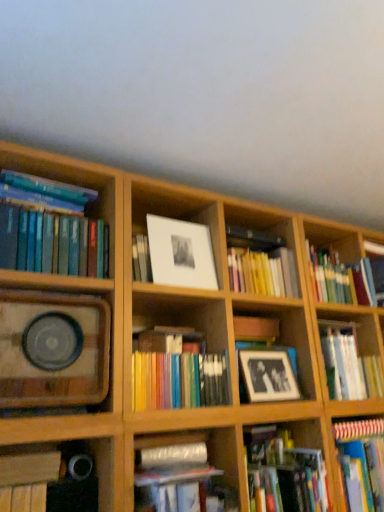
Question: Is black matte picture frame at center, the second picture frame positioned from the left, completely or partially inside wooden speaker at left, marked as the 2th shelf in a right-to-left arrangement?

Choices:
 (A) no
 (B) yes

Answer: (A)

Question: Are wooden speaker at left, marked as the 2th shelf in a right-to-left arrangement, and black matte picture frame at center, the second picture frame positioned from the left, beside each other?

Choices:
 (A) yes
 (B) no

Answer: (B)

Question: Is wooden speaker at left, marked as the 2th shelf in a right-to-left arrangement, smaller than black matte picture frame at center, the 1th picture frame in the bottom-to-top sequence?

Choices:
 (A) yes
 (B) no

Answer: (B)

Question: Considering the relative sizes of wooden speaker at left, the first shelf positioned from the left, and black matte picture frame at center, the second picture frame positioned from the left, in the image provided, is wooden speaker at left, the first shelf positioned from the left, wider than black matte picture frame at center, the second picture frame positioned from the left,?

Choices:
 (A) yes
 (B) no

Answer: (A)

Question: Can you confirm if wooden speaker at left, marked as the 2th shelf in a right-to-left arrangement, is thinner than black matte picture frame at center, the second picture frame positioned from the left?

Choices:
 (A) no
 (B) yes

Answer: (A)

Question: Are wooden speaker at left, marked as the 2th shelf in a right-to-left arrangement, and black matte picture frame at center, arranged as the 1th picture frame when viewed from the right, far apart?

Choices:
 (A) no
 (B) yes

Answer: (A)

Question: Is black matte picture frame at center, the 1th picture frame in the bottom-to-top sequence, to the left of yellow matte book at center, which is counted as the 3th book, starting from the right, from the viewer's perspective?

Choices:
 (A) no
 (B) yes

Answer: (A)

Question: Is black matte picture frame at center, the second picture frame positioned from the left, facing towards yellow matte book at center, which is counted as the 3th book, starting from the right?

Choices:
 (A) no
 (B) yes

Answer: (A)

Question: From the image's perspective, is black matte picture frame at center, the 1th picture frame in the bottom-to-top sequence, over yellow matte book at center, which is counted as the 3th book, starting from the right?

Choices:
 (A) no
 (B) yes

Answer: (A)

Question: Is black matte picture frame at center, the 1th picture frame in the bottom-to-top sequence, wider than yellow matte book at center, which is counted as the 3th book, starting from the right?

Choices:
 (A) no
 (B) yes

Answer: (A)

Question: Is black matte picture frame at center, the 1th picture frame in the bottom-to-top sequence, closer to the viewer compared to yellow matte book at center, which is counted as the 3th book, starting from the right?

Choices:
 (A) yes
 (B) no

Answer: (A)

Question: Is the surface of black matte picture frame at center, the 1th picture frame in the bottom-to-top sequence, in direct contact with yellow matte book at center, which is counted as the 3th book, starting from the right?

Choices:
 (A) no
 (B) yes

Answer: (A)

Question: Is black matte book at lower left, the 3th book positioned from the left, outside yellow matte book at center, which is counted as the 6th book, starting from the left?

Choices:
 (A) yes
 (B) no

Answer: (A)